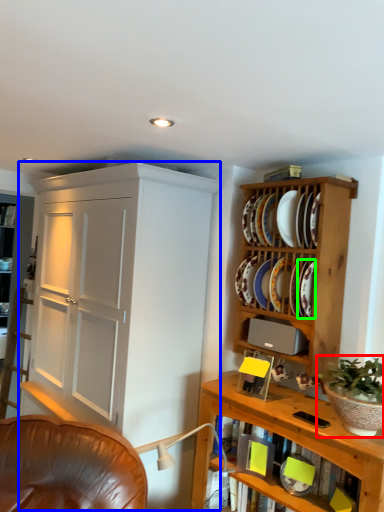
Question: Which object is positioned closest to houseplant (highlighted by a red box)? Select from cupboard (highlighted by a blue box) and platter (highlighted by a green box).

Choices:
 (A) cupboard
 (B) platter

Answer: (B)